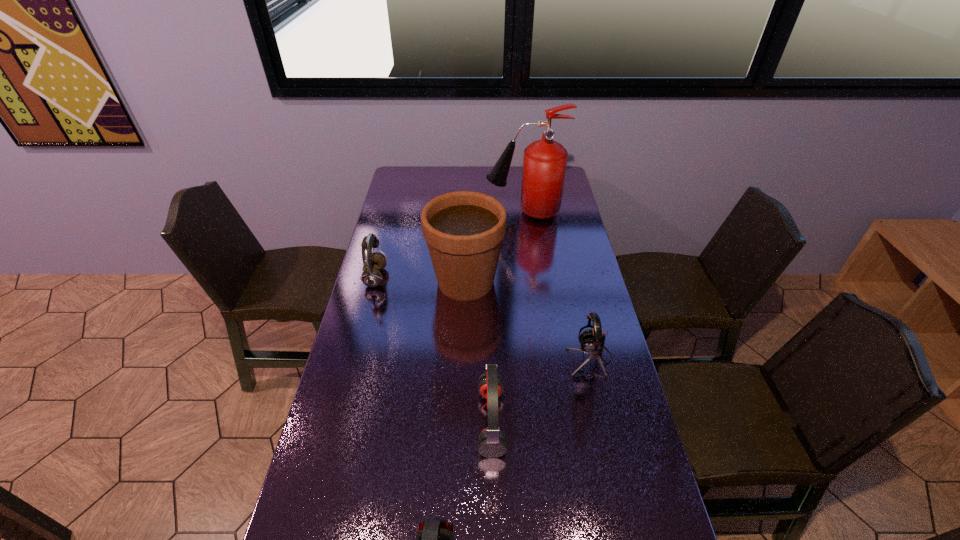
What are the coordinates of `fire extinguisher` in the screenshot? It's located at (544, 165).

Find the location of `the tallest object`. the tallest object is located at coordinates (544, 165).

I want to click on flowerpot, so (464, 230).

What are the coordinates of `the farthest earphone` in the screenshot? It's located at (373, 262).

Find the location of a particular element. This screenshot has width=960, height=540. the leftmost earphone is located at coordinates (373, 262).

I want to click on the third nearest object, so click(x=592, y=342).

I want to click on the third nearest earphone, so click(x=592, y=342).

I want to click on the third earphone from left to right, so click(x=492, y=443).

Find the location of a particular element. Image resolution: width=960 pixels, height=540 pixels. the second nearest object is located at coordinates (492, 443).

Find the location of a particular element. The width and height of the screenshot is (960, 540). free spot located 0.070m with the nozzle aimed from the fire extinguisher is located at coordinates (469, 212).